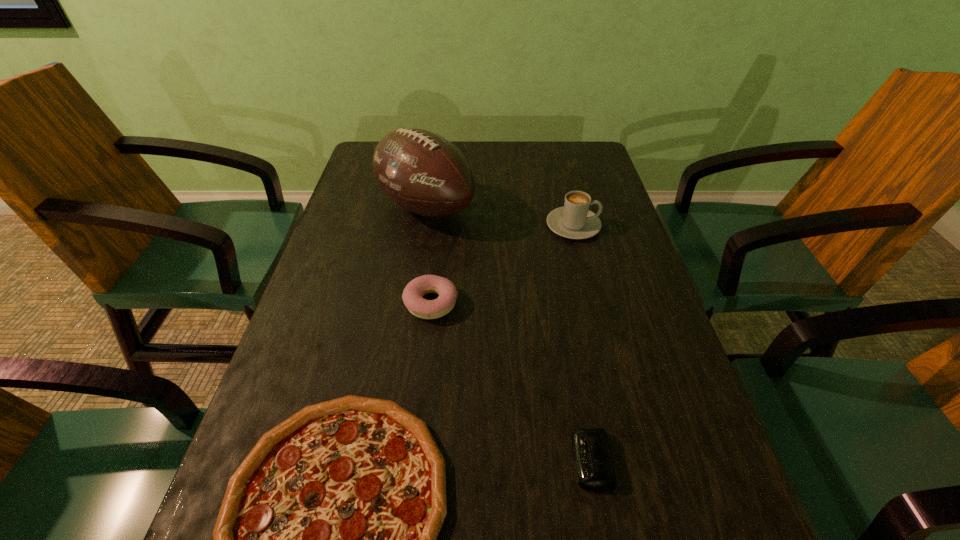
Locate an element on the screen. The height and width of the screenshot is (540, 960). object that is at the left edge is located at coordinates (424, 173).

Find the location of `object that is at the right edge`. object that is at the right edge is located at coordinates (574, 220).

In order to click on vacant area at the left edge in this screenshot , I will do `click(343, 314)`.

You are a GUI agent. You are given a task and a screenshot of the screen. Output one action in this format:
    pyautogui.click(x=<x>, y=<y>)
    Task: Click on the free space at the right edge
    This screenshot has width=960, height=540.
    Given the screenshot: What is the action you would take?
    610,275

Identify the location of vacant space at the far right corner of the desktop. (587, 168).

Identify the location of vacant space in between the third nearest object and the alarm clock. (511, 382).

The width and height of the screenshot is (960, 540). What are the coordinates of `empty location between the second tallest object and the football (American)` in the screenshot? It's located at (499, 217).

Where is `empty space between the fourth shortest object and the football (American)`? This screenshot has width=960, height=540. empty space between the fourth shortest object and the football (American) is located at coordinates (499, 217).

Locate an element on the screen. This screenshot has height=540, width=960. free space between the doughnut and the cappuccino is located at coordinates (502, 265).

You are a GUI agent. You are given a task and a screenshot of the screen. Output one action in this format:
    pyautogui.click(x=<x>, y=<y>)
    Task: Click on the free point between the football (American) and the alarm clock
    
    Given the screenshot: What is the action you would take?
    pyautogui.click(x=508, y=334)